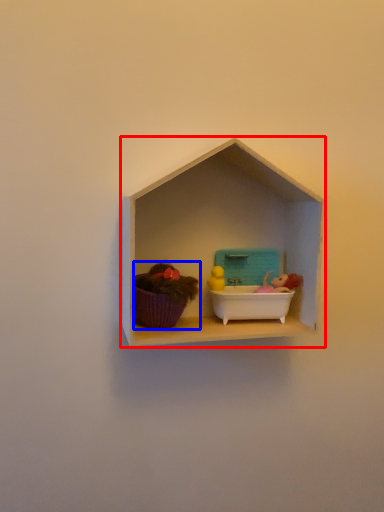
Question: Which object appears closest to the camera in this image, shelf (highlighted by a red box) or toy (highlighted by a blue box)?

Choices:
 (A) shelf
 (B) toy

Answer: (A)